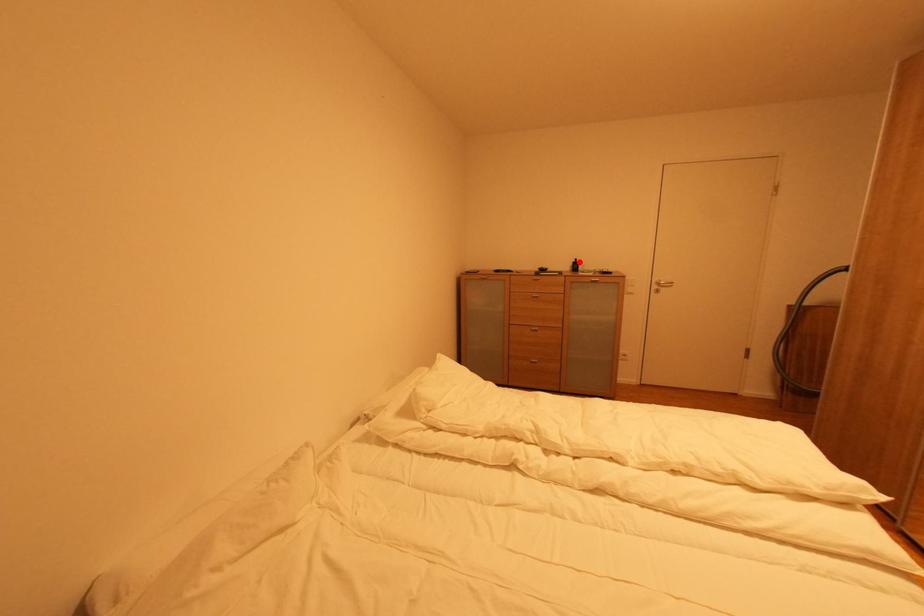
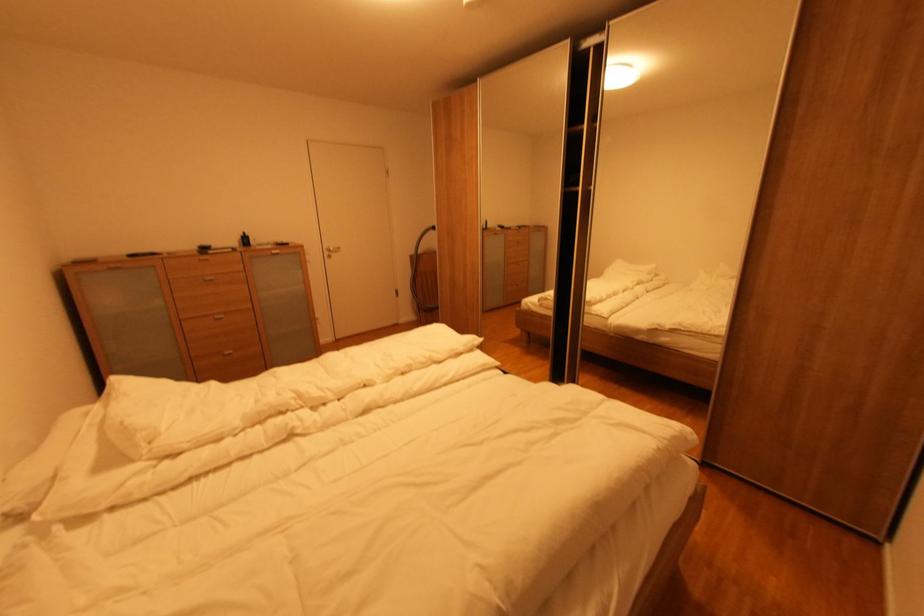
Find the pixel in the second image that matches the highlighted location in the first image.

(248, 237)